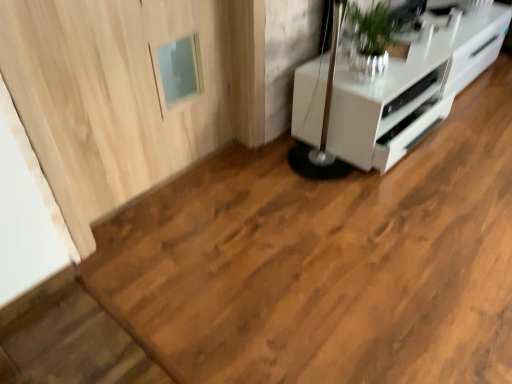
Question: Is white glossy appliance at upper right wider or thinner than light wood door at upper left?

Choices:
 (A) wide
 (B) thin

Answer: (A)

Question: Looking at the image, does white glossy appliance at upper right seem bigger or smaller compared to light wood door at upper left?

Choices:
 (A) big
 (B) small

Answer: (B)

Question: Which of these objects is positioned closest to the light wood door at upper left?

Choices:
 (A) white glossy appliance at upper right
 (B) white glossy cabinet at upper right
 (C) green leafy plant at upper right

Answer: (C)

Question: Which object is the farthest from the green leafy plant at upper right?

Choices:
 (A) light wood door at upper left
 (B) white glossy appliance at upper right
 (C) white glossy cabinet at upper right

Answer: (A)